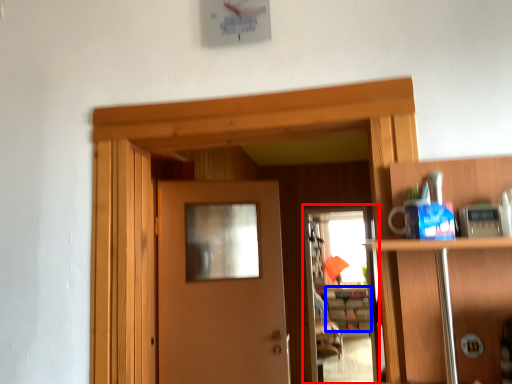
Question: Which of the following is the closest to the observer, screen door (highlighted by a red box) or cabinetry (highlighted by a blue box)?

Choices:
 (A) screen door
 (B) cabinetry

Answer: (A)